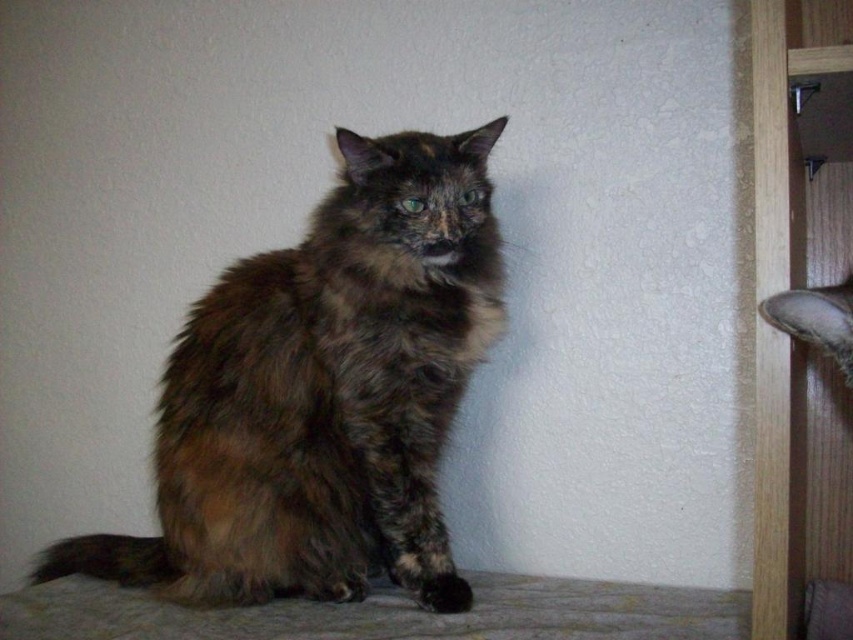
You are a photographer who needs to take a closeup shot of the brown fur cat at center. Your camera has a minimum focusing distance of 1.5 meters. Can you take the photo without moving either the camera or the cat?

The brown fur cat at center and camera are 1.28 meters apart from each other. Since the minimum focusing distance is 1.5 meters, the camera cannot focus at this distance. You need to move either the camera or the cat further apart to at least 1.5 meters to take the closeup shot.

You are a photographer trying to capture a photo of both the brown fur cat at center and the brown shaggy cat at right. Based on their positions, which cat should you focus on first to ensure both are in the frame?

The brown fur cat at center is positioned under the brown shaggy cat at right, so you should focus on the brown shaggy cat at right first to ensure both are in the frame.

You are a photographer trying to capture a portrait of the brown fur cat at center and the brown shaggy cat at right. Since you want both cats to appear the same size in the photo, which cat should you move closer to the camera?

The brown fur cat at center is much taller than the brown shaggy cat at right. To make them appear the same size in the photo, you should move the shorter brown shaggy cat at right closer to the camera while keeping the taller brown fur cat at center further back.